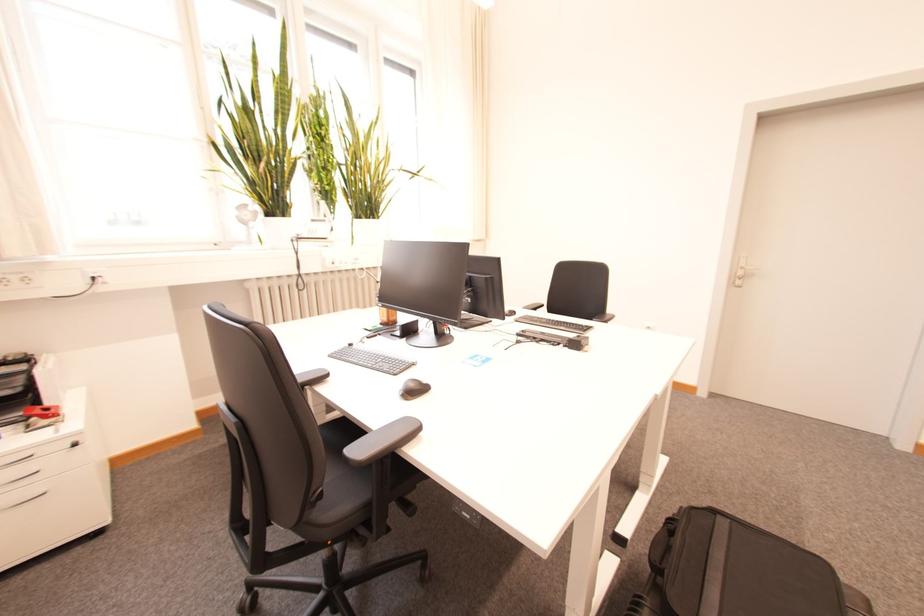
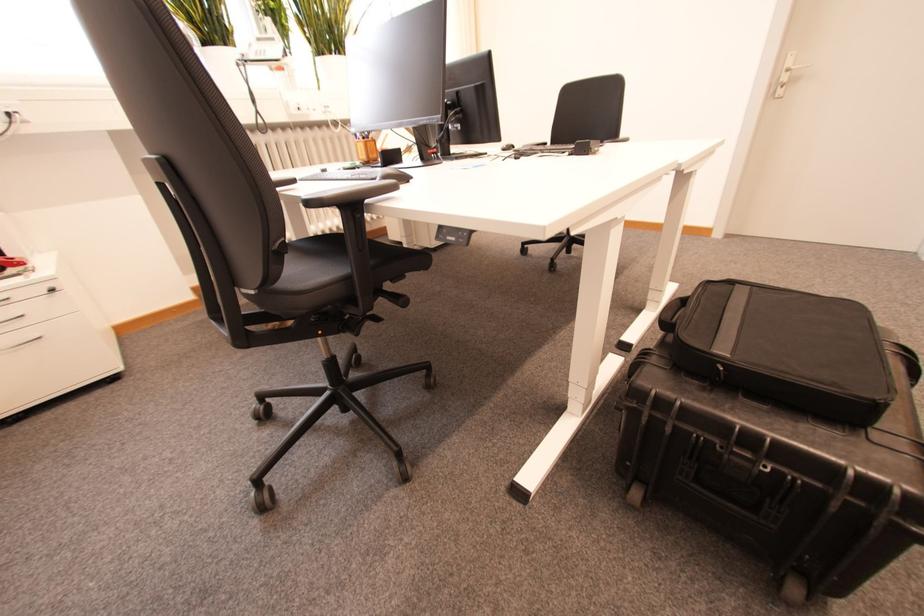
Locate, in the second image, the point that corresponds to point (38, 456) in the first image.

(15, 300)